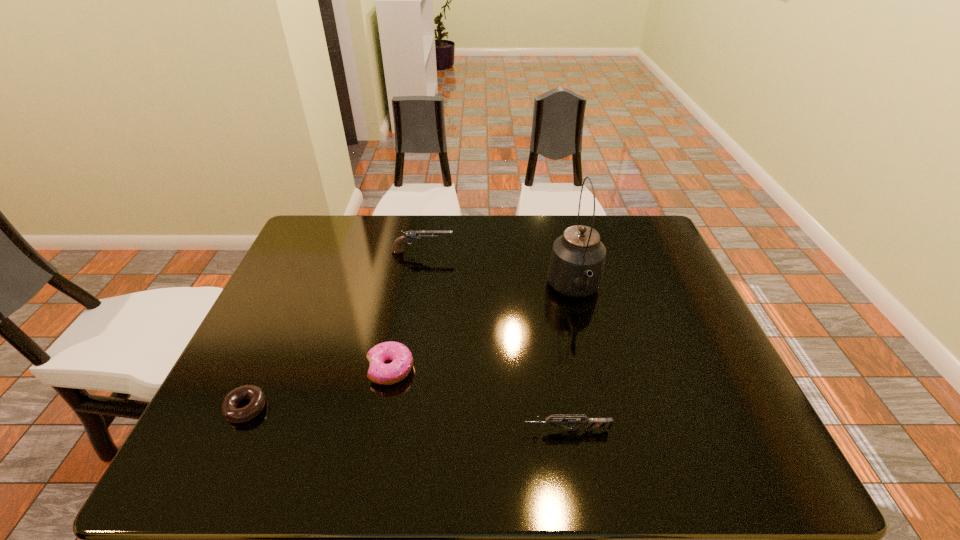
In the image, there is a desktop. At what (x,y) coordinates should I click in order to perform the action: click on vacant region at the near edge. Please return your answer as a coordinate pair (x, y). Looking at the image, I should click on (515, 458).

This screenshot has height=540, width=960. I want to click on blank area at the left edge, so click(x=282, y=281).

Image resolution: width=960 pixels, height=540 pixels. I want to click on vacant space at the right edge, so click(664, 350).

At what (x,y) coordinates should I click in order to perform the action: click on vacant area at the far left corner. Please return your answer as a coordinate pair (x, y). The width and height of the screenshot is (960, 540). Looking at the image, I should click on (345, 230).

At what (x,y) coordinates should I click in order to perform the action: click on vacant space at the near left corner. Please return your answer as a coordinate pair (x, y). Image resolution: width=960 pixels, height=540 pixels. Looking at the image, I should click on (194, 463).

You are a GUI agent. You are given a task and a screenshot of the screen. Output one action in this format:
    pyautogui.click(x=<x>, y=<y>)
    Task: Click on the vacant position at the far right corner of the desktop
    The height and width of the screenshot is (540, 960).
    Given the screenshot: What is the action you would take?
    pyautogui.click(x=634, y=231)

In order to click on free spot between the shorter gun and the tallest object in this screenshot , I will do `click(571, 361)`.

Identify the location of free space between the tallest object and the farther gun. (499, 272).

Locate an element on the screen. This screenshot has width=960, height=540. unoccupied area between the fourth farthest object and the third nearest object is located at coordinates (318, 388).

Image resolution: width=960 pixels, height=540 pixels. Identify the location of free space between the tallest object and the farther doughnut. (483, 330).